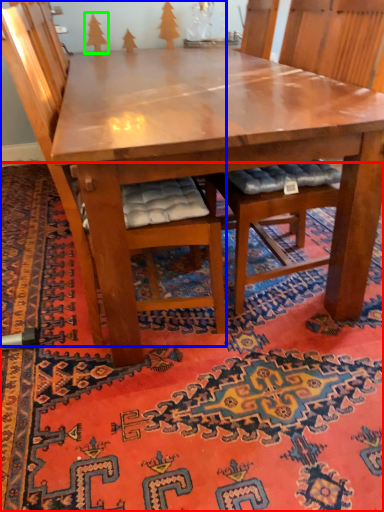
Question: Which object is the farthest from mat (highlighted by a red box)? Choose among these: chair (highlighted by a blue box) or tree (highlighted by a green box).

Choices:
 (A) chair
 (B) tree

Answer: (B)